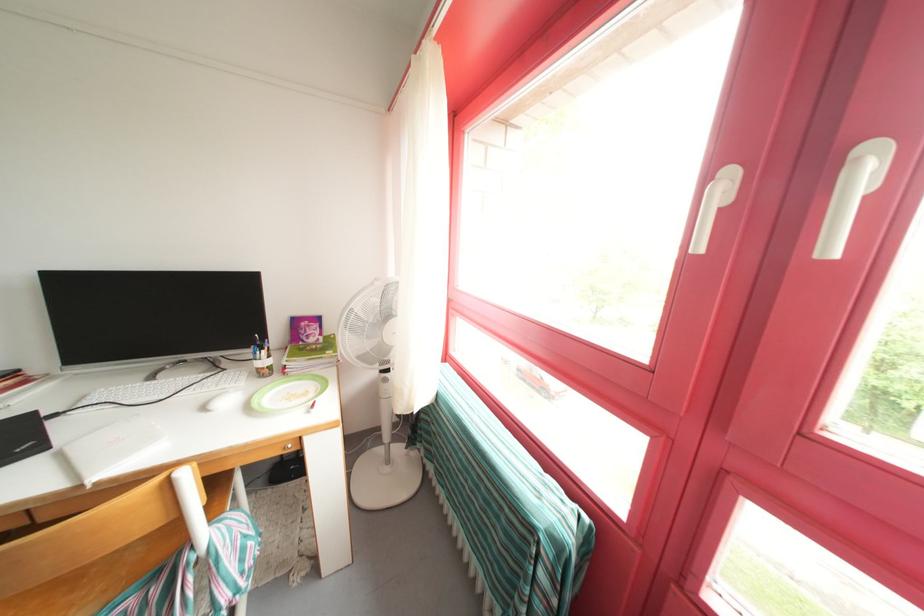
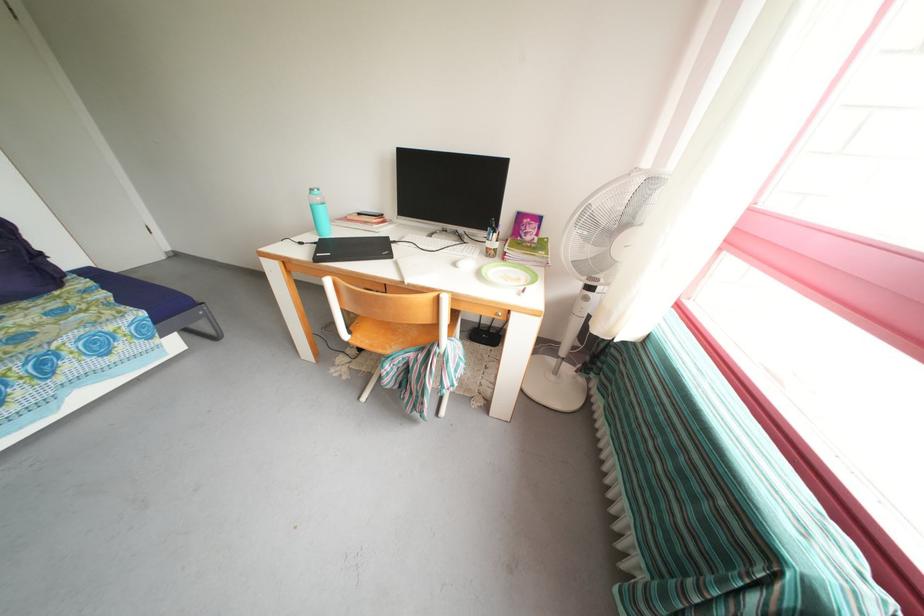
In the second image, find the point that corresponds to (x=263, y=376) in the first image.

(494, 254)